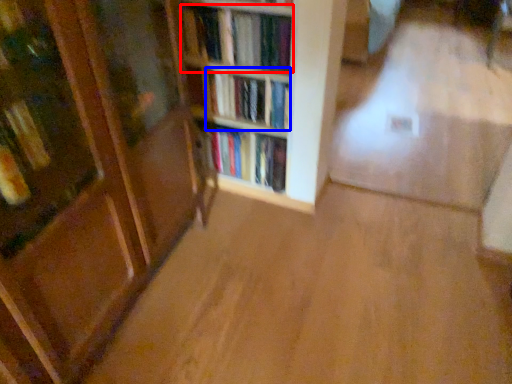
Question: Among these objects, which one is farthest to the camera, book (highlighted by a red box) or book (highlighted by a blue box)?

Choices:
 (A) book
 (B) book

Answer: (B)